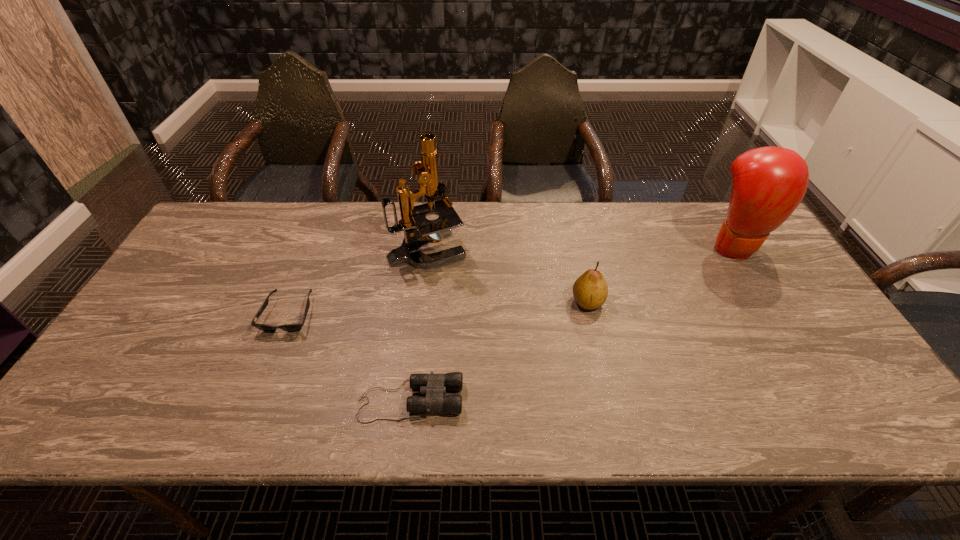
You are a GUI agent. You are given a task and a screenshot of the screen. Output one action in this format:
    pyautogui.click(x=<x>, y=<y>)
    Task: Click on the microscope
    This screenshot has width=960, height=540.
    Given the screenshot: What is the action you would take?
    pyautogui.click(x=413, y=217)

You are a GUI agent. You are given a task and a screenshot of the screen. Output one action in this format:
    pyautogui.click(x=<x>, y=<y>)
    Task: Click on the second tallest object
    The height and width of the screenshot is (540, 960).
    Given the screenshot: What is the action you would take?
    pyautogui.click(x=769, y=183)

I want to click on boxing glove, so click(x=769, y=183).

Find the location of a particular element. The height and width of the screenshot is (540, 960). the third tallest object is located at coordinates (590, 290).

Locate an element on the screen. The width and height of the screenshot is (960, 540). the fourth object from left to right is located at coordinates (590, 290).

Where is `binoculars`? binoculars is located at coordinates (434, 386).

Identify the location of sunglasses. (296, 327).

Where is `free space located at the eyepiece of the microscope`? Image resolution: width=960 pixels, height=540 pixels. free space located at the eyepiece of the microscope is located at coordinates (486, 248).

Locate an element on the screen. This screenshot has width=960, height=540. vacant space situated on the striking surface of the rightmost object is located at coordinates (802, 356).

The width and height of the screenshot is (960, 540). In order to click on vacant space located on the back of the third shortest object in this screenshot , I will do `click(581, 272)`.